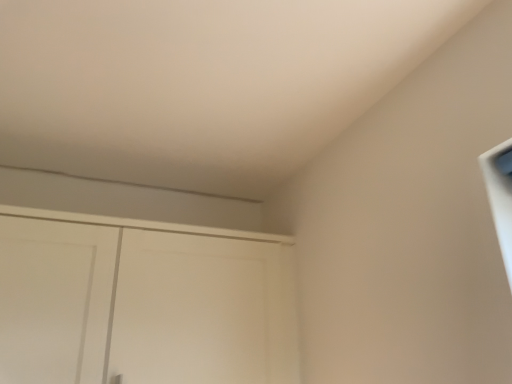
You are a GUI agent. You are given a task and a screenshot of the screen. Output one action in this format:
    pyautogui.click(x=<x>, y=<y>)
    Task: Click on the white matte door at lower left
    The height and width of the screenshot is (384, 512).
    Given the screenshot: What is the action you would take?
    pyautogui.click(x=142, y=304)

What do you see at coordinates (142, 304) in the screenshot?
I see `white matte door at lower left` at bounding box center [142, 304].

The height and width of the screenshot is (384, 512). In order to click on white matte door at lower left in this screenshot , I will do `click(142, 304)`.